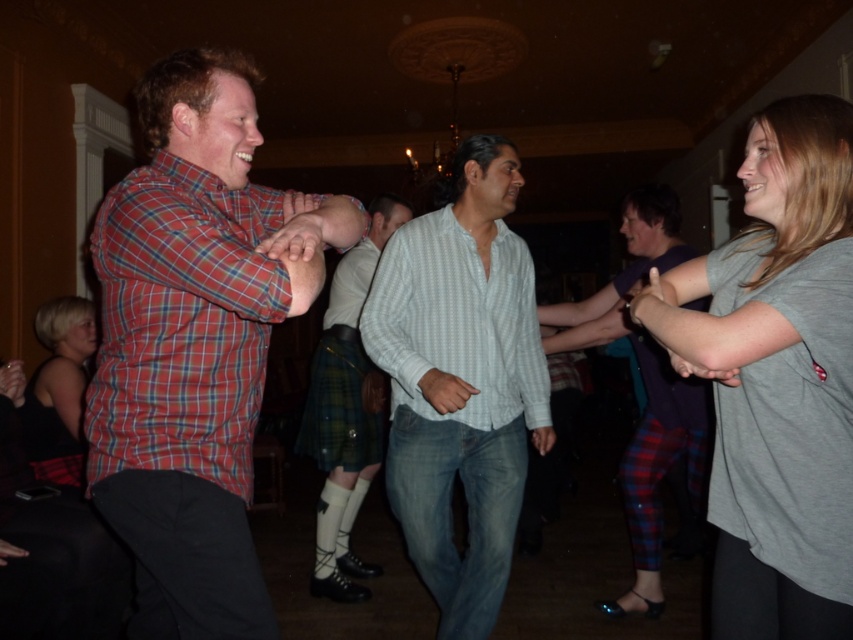
Is point (752, 422) positioned after point (448, 308)?

That is False.

Is gray cotton t-shirt at right thinner than white striped shirt at center?

Yes.

Is point (815, 296) positioned in front of point (431, 364)?

That is True.

In order to click on gray cotton t-shirt at right in this screenshot , I will do `click(776, 376)`.

Is plaid shirt at left taller than gray cotton t-shirt at right?

Yes, plaid shirt at left is taller than gray cotton t-shirt at right.

Can you confirm if plaid shirt at left is positioned below gray cotton t-shirt at right?

No.

You are a GUI agent. You are given a task and a screenshot of the screen. Output one action in this format:
    pyautogui.click(x=<x>, y=<y>)
    Task: Click on the plaid shirt at left
    This screenshot has width=853, height=640.
    Given the screenshot: What is the action you would take?
    (x=195, y=342)

This screenshot has height=640, width=853. In order to click on plaid shirt at left in this screenshot , I will do `click(195, 342)`.

Is plaid shirt at left above plaid fabric pants at center?

Indeed, plaid shirt at left is positioned over plaid fabric pants at center.

Who is positioned more to the right, plaid shirt at left or plaid fabric pants at center?

plaid fabric pants at center is more to the right.

What do you see at coordinates (195, 342) in the screenshot?
I see `plaid shirt at left` at bounding box center [195, 342].

The height and width of the screenshot is (640, 853). I want to click on plaid shirt at left, so click(x=195, y=342).